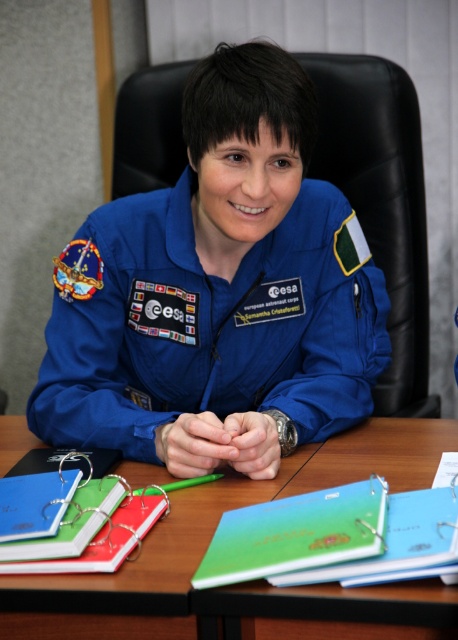
Question: Among these points, which one is nearest to the camera?

Choices:
 (A) click(x=317, y=540)
 (B) click(x=151, y=294)
 (C) click(x=127, y=563)

Answer: (A)

Question: Can you confirm if blue fabric astronaut suit at center is smaller than green matte binder at center?

Choices:
 (A) yes
 (B) no

Answer: (B)

Question: Is blue fabric astronaut suit at center above green matte binder at center?

Choices:
 (A) yes
 (B) no

Answer: (A)

Question: Which point is closer to the camera?

Choices:
 (A) wooden table at center
 (B) blue fabric astronaut suit at center

Answer: (A)

Question: Which object is the closest to the wooden table at center?

Choices:
 (A) green matte binder at center
 (B) blue fabric astronaut suit at center

Answer: (A)

Question: Can you confirm if blue fabric astronaut suit at center is positioned above green matte binder at center?

Choices:
 (A) yes
 (B) no

Answer: (A)